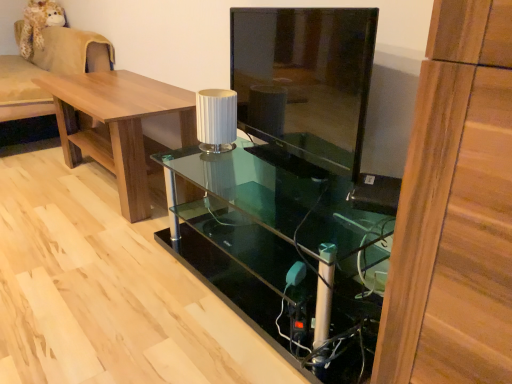
Where is `vacant point above brown wood table at left (from a real-world perspective)`? vacant point above brown wood table at left (from a real-world perspective) is located at coordinates (120, 86).